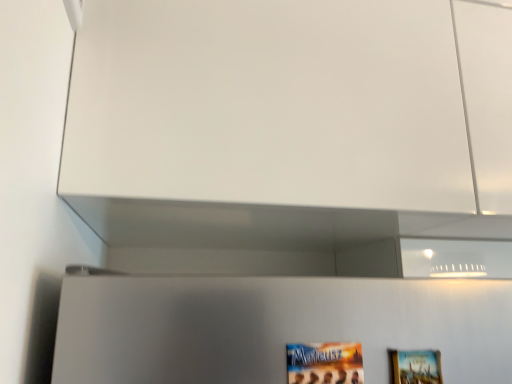
Question: Based on their positions, is wooden picture frame at lower right located to the left or right of matte paper movie poster at lower center?

Choices:
 (A) left
 (B) right

Answer: (B)

Question: From their relative heights in the image, would you say wooden picture frame at lower right is taller or shorter than matte paper movie poster at lower center?

Choices:
 (A) short
 (B) tall

Answer: (B)

Question: Considering the positions of wooden picture frame at lower right and matte paper movie poster at lower center in the image, is wooden picture frame at lower right wider or thinner than matte paper movie poster at lower center?

Choices:
 (A) wide
 (B) thin

Answer: (A)

Question: Is matte paper movie poster at lower center taller or shorter than wooden picture frame at lower right?

Choices:
 (A) tall
 (B) short

Answer: (B)

Question: Based on their sizes in the image, would you say matte paper movie poster at lower center is bigger or smaller than wooden picture frame at lower right?

Choices:
 (A) small
 (B) big

Answer: (A)

Question: Relative to wooden picture frame at lower right, is matte paper movie poster at lower center in front or behind?

Choices:
 (A) front
 (B) behind

Answer: (A)

Question: From a real-world perspective, relative to wooden picture frame at lower right, is matte paper movie poster at lower center vertically above or below?

Choices:
 (A) above
 (B) below

Answer: (B)